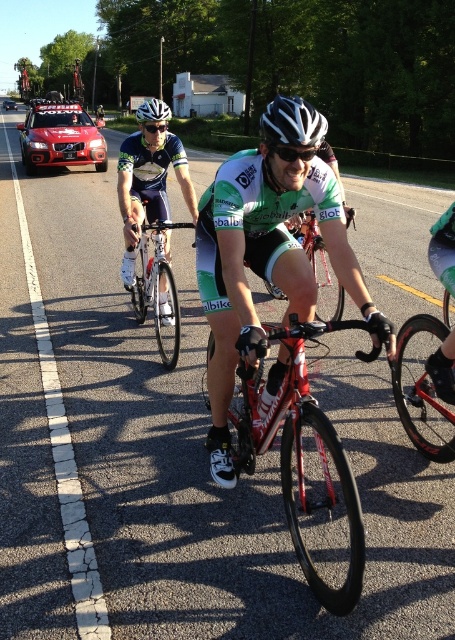
Can you confirm if shiny red bike at center is thinner than matte black helmet at center?

Yes, shiny red bike at center is thinner than matte black helmet at center.

You are a GUI agent. You are given a task and a screenshot of the screen. Output one action in this format:
    pyautogui.click(x=<x>, y=<y>)
    Task: Click on the shiny red bike at center
    Image resolution: width=455 pixels, height=640 pixels.
    Given the screenshot: What is the action you would take?
    pyautogui.click(x=303, y=456)

Identify the location of shiny red bike at center. click(x=303, y=456).

Which is in front, point (319, 579) or point (142, 115)?

Point (319, 579) is more forward.

Is point (308, 424) positioned after point (162, 115)?

No, it is in front of (162, 115).

Between point (339, 588) and point (137, 113), which one is positioned behind?

Positioned behind is point (137, 113).

Locate an element on the screen. The image size is (455, 640). shiny red bike at center is located at coordinates (303, 456).

Does shiny silver bicycle at center have a greater width compared to matte black helmet at center?

Incorrect, shiny silver bicycle at center's width does not surpass matte black helmet at center's.

Looking at this image, is shiny silver bicycle at center further to the viewer compared to matte black helmet at center?

Yes, shiny silver bicycle at center is further from the viewer.

Between point (173, 356) and point (293, 141), which one is positioned in front?

Point (293, 141)

Locate an element on the screen. This screenshot has height=640, width=455. shiny silver bicycle at center is located at coordinates (156, 288).